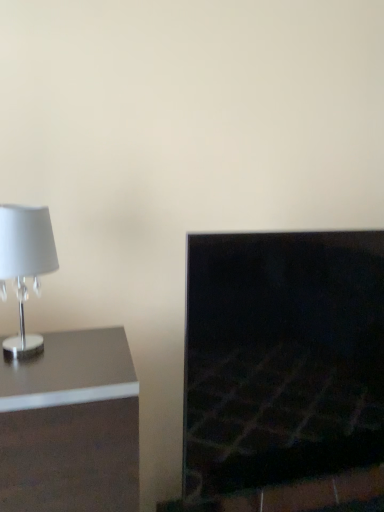
Locate an element on the screen. The image size is (384, 512). vacant space situated above satin silver lamp at left (from a real-world perspective) is located at coordinates (65, 359).